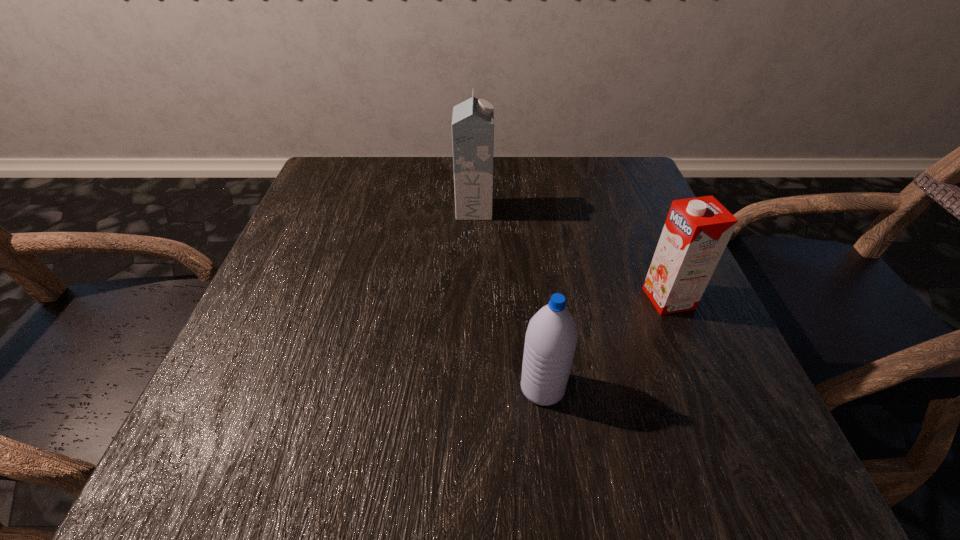
At what (x,y) coordinates should I click in order to perform the action: click on free space that is in between the nearer carton and the tallest object. Please return your answer as a coordinate pair (x, y). The height and width of the screenshot is (540, 960). Looking at the image, I should click on (571, 254).

Where is `vacant space that's between the rightmost object and the second object from right to left`? This screenshot has width=960, height=540. vacant space that's between the rightmost object and the second object from right to left is located at coordinates (606, 343).

This screenshot has width=960, height=540. What are the coordinates of `unoccupied area between the taller carton and the second farthest object` in the screenshot? It's located at (571, 254).

Find the location of a particular element. This screenshot has height=540, width=960. blank region between the nearest object and the taller carton is located at coordinates (509, 299).

At what (x,y) coordinates should I click in order to perform the action: click on free space between the farther carton and the second object from left to right. Please return your answer as a coordinate pair (x, y). Image resolution: width=960 pixels, height=540 pixels. Looking at the image, I should click on (509, 299).

The width and height of the screenshot is (960, 540). What are the coordinates of `vacant region between the farther carton and the nearer carton` in the screenshot? It's located at (571, 254).

I want to click on vacant space that is in between the farthest object and the shorter carton, so click(x=571, y=254).

I want to click on free point between the water bottle and the farther carton, so click(509, 299).

Locate which object is the closest to the tallest object. Please provide its 2D coordinates. Your answer should be formatted as a tuple, i.e. [(x, y)], where the tuple contains the x and y coordinates of a point satisfying the conditions above.

[(697, 230)]

This screenshot has height=540, width=960. I want to click on object that is the second closest to the right carton, so click(473, 120).